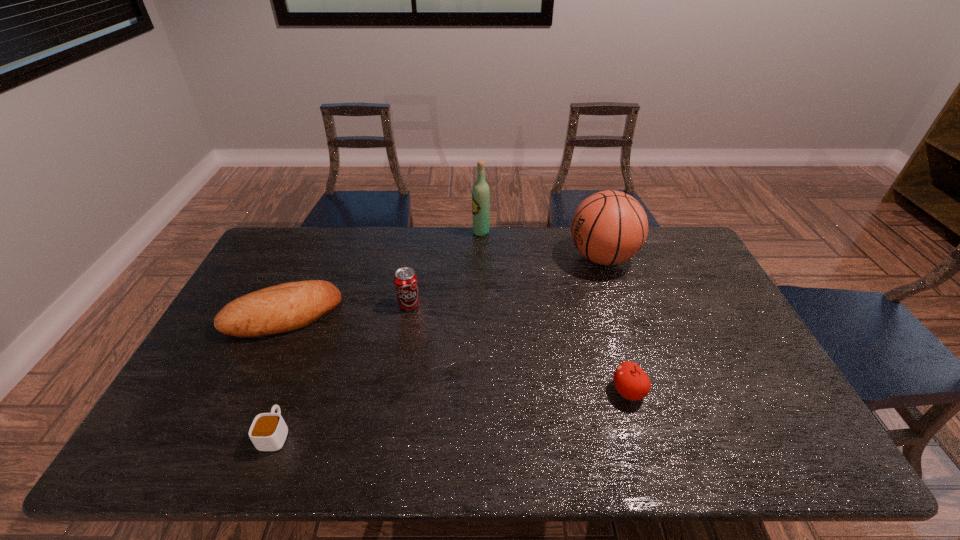
You are a GUI agent. You are given a task and a screenshot of the screen. Output one action in this format:
    pyautogui.click(x=<x>, y=<y>)
    Task: Click on the vacant space at the near left corner of the desktop
    The width and height of the screenshot is (960, 540).
    Given the screenshot: What is the action you would take?
    pyautogui.click(x=171, y=434)

Find the location of a particular element. free point at the far right corner is located at coordinates (695, 260).

Locate an element on the screen. vacant space that is in between the third object from left to right and the fifth shortest object is located at coordinates (506, 281).

Locate an element on the screen. This screenshot has height=540, width=960. vacant space in between the nearest object and the fourth shortest object is located at coordinates (343, 369).

Find the location of a particular element. The height and width of the screenshot is (540, 960). free spot between the apple and the basketball is located at coordinates (615, 325).

Locate an element on the screen. The height and width of the screenshot is (540, 960). vacant space that's between the bread and the apple is located at coordinates (456, 353).

I want to click on vacant point located between the bread and the basketball, so click(443, 286).

In order to click on vacant space that's between the basketball and the bread in this screenshot , I will do `click(443, 286)`.

Image resolution: width=960 pixels, height=540 pixels. Identify the location of vacant area that lies between the bread and the basketball. (443, 286).

This screenshot has width=960, height=540. Find the location of `free space that is in between the fifth farthest object and the tallest object`. free space that is in between the fifth farthest object and the tallest object is located at coordinates (555, 312).